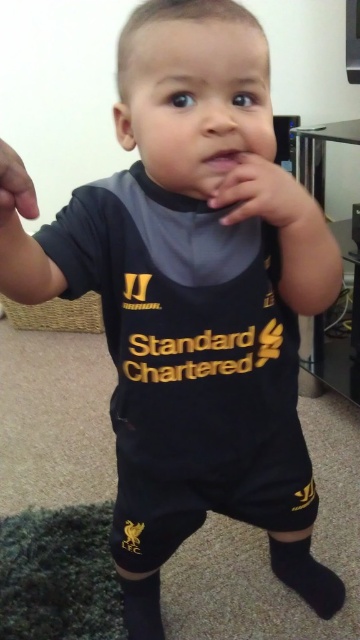
Question: Among these points, which one is nearest to the camera?

Choices:
 (A) (272, 209)
 (B) (20, 205)

Answer: (B)

Question: Among these points, which one is nearest to the camera?

Choices:
 (A) (289, 195)
 (B) (3, 216)

Answer: (B)

Question: Does matte black hand at center come behind matte black hand at left?

Choices:
 (A) yes
 (B) no

Answer: (A)

Question: In this image, where is matte black hand at center located relative to matte black hand at left?

Choices:
 (A) above
 (B) below

Answer: (A)

Question: Is matte black hand at center behind matte black hand at left?

Choices:
 (A) yes
 (B) no

Answer: (A)